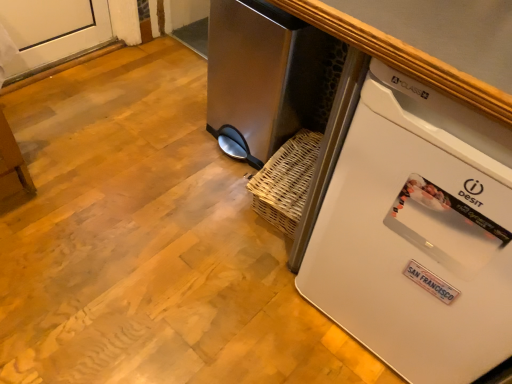
Question: Choose the correct answer: Is stainless steel trash can at center inside white plastic refrigerator at lower right or outside it?

Choices:
 (A) outside
 (B) inside

Answer: (A)

Question: From a real-world perspective, is stainless steel trash can at center physically located above or below white plastic refrigerator at lower right?

Choices:
 (A) below
 (B) above

Answer: (A)

Question: Does point (281, 139) appear closer or farther from the camera than point (396, 327)?

Choices:
 (A) closer
 (B) farther

Answer: (B)

Question: In terms of size, does white plastic refrigerator at lower right appear bigger or smaller than stainless steel trash can at center?

Choices:
 (A) small
 (B) big

Answer: (B)

Question: Considering the positions of white plastic refrigerator at lower right and stainless steel trash can at center in the image, is white plastic refrigerator at lower right wider or thinner than stainless steel trash can at center?

Choices:
 (A) wide
 (B) thin

Answer: (A)

Question: From the image's perspective, relative to stainless steel trash can at center, is white plastic refrigerator at lower right above or below?

Choices:
 (A) below
 (B) above

Answer: (A)

Question: Considering the relative positions of white plastic refrigerator at lower right and stainless steel trash can at center in the image provided, is white plastic refrigerator at lower right to the left or to the right of stainless steel trash can at center?

Choices:
 (A) left
 (B) right

Answer: (B)